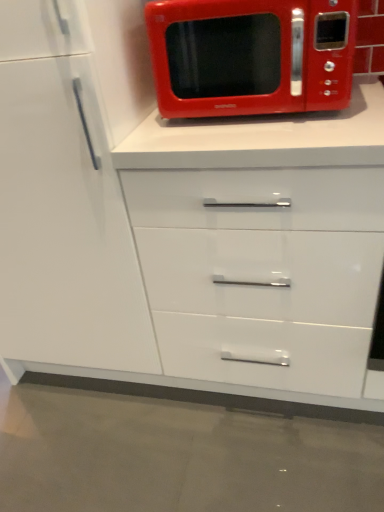
Question: From a real-world perspective, is white glossy cabinet at lower left physically located above or below shiny red microwave at upper center?

Choices:
 (A) above
 (B) below

Answer: (B)

Question: Considering the relative positions of white glossy cabinet at lower left and shiny red microwave at upper center in the image provided, is white glossy cabinet at lower left to the left or to the right of shiny red microwave at upper center?

Choices:
 (A) left
 (B) right

Answer: (A)

Question: Is white glossy cabinet at lower left wider or thinner than shiny red microwave at upper center?

Choices:
 (A) thin
 (B) wide

Answer: (B)

Question: Based on their positions, is shiny red microwave at upper center located to the left or right of white glossy cabinet at lower left?

Choices:
 (A) left
 (B) right

Answer: (B)

Question: In terms of height, does shiny red microwave at upper center look taller or shorter compared to white glossy cabinet at lower left?

Choices:
 (A) tall
 (B) short

Answer: (B)

Question: Considering the positions of shiny red microwave at upper center and white glossy cabinet at lower left in the image, is shiny red microwave at upper center wider or thinner than white glossy cabinet at lower left?

Choices:
 (A) wide
 (B) thin

Answer: (B)

Question: Is point (289, 11) positioned closer to the camera than point (41, 169)?

Choices:
 (A) farther
 (B) closer

Answer: (B)